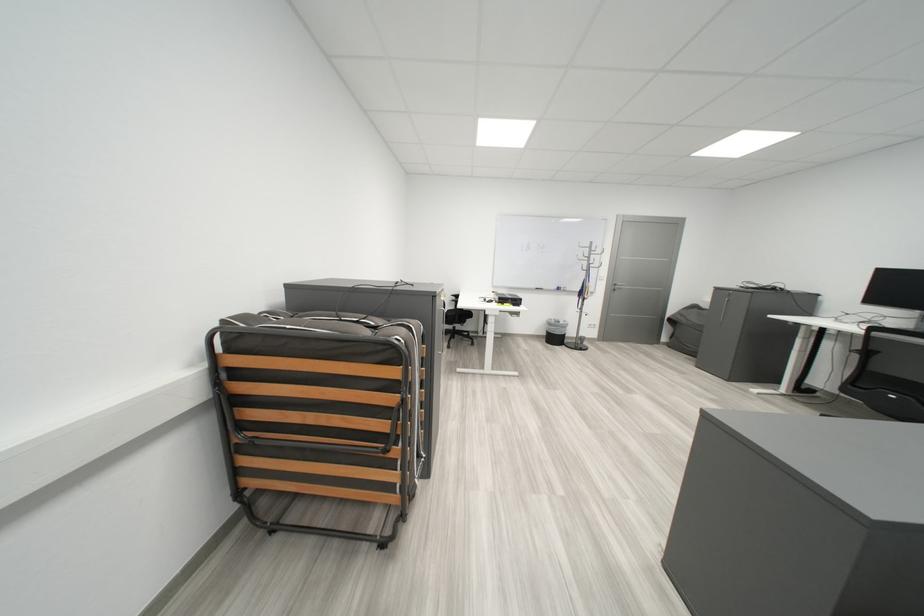
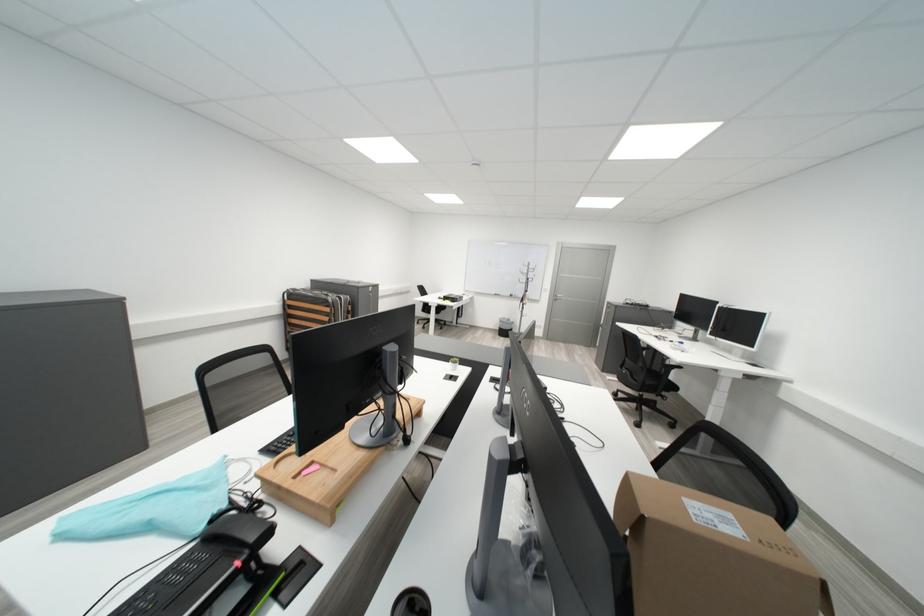
The images are taken continuously from a first-person perspective. In which direction are you moving?

The cameraman moved toward right, backward.